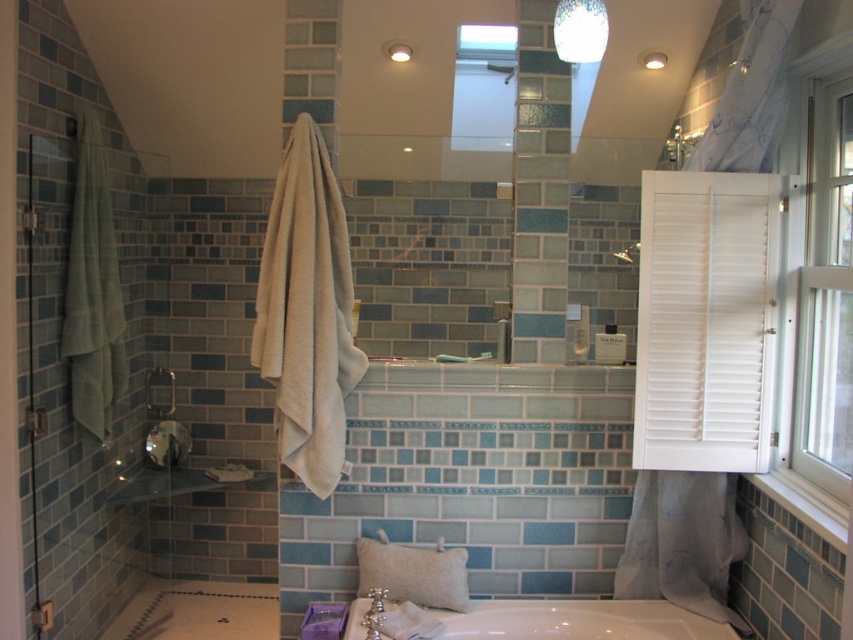
You are a delivery person trying to place a package that is 6 feet long in the bathroom. The package must be placed between the white wooden shutter at right and the shower area. Is there enough space?

The distance between the white wooden shutter at right and the shower area is 6.28 feet, so the 6 feet long package can fit between them.

What object is located at the coordinates point (578, 620) in the image?

The point (578, 620) indicates the white glossy bathtub at center.

You are a delivery person carrying a package that requires a clear path of 5 feet to maneuver safely. You need to move from the bathroom entrance to the sink located near the shower. Is the space between the white glossy bathtub at center and the matte white shower at upper center sufficient for your passage?

The distance between the white glossy bathtub at center and the matte white shower at upper center is 4.64 feet. Since the required clear path is 5 feet, the space is insufficient for safe maneuvering.